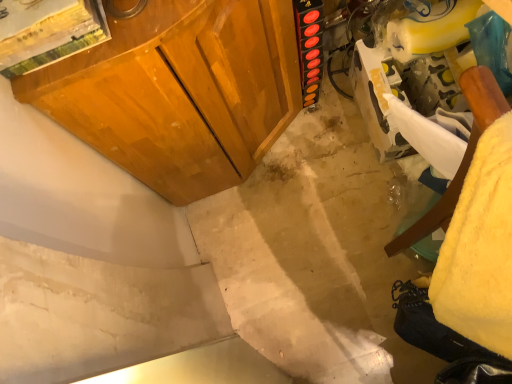
In order to face wooden cabinet at left, should I rotate leftwards or rightwards?

Rotate your view left by about 5.799°.

You are a GUI agent. You are given a task and a screenshot of the screen. Output one action in this format:
    pyautogui.click(x=<x>, y=<y>)
    Task: Click on the wooden cabinet at left
    This screenshot has height=384, width=512.
    Given the screenshot: What is the action you would take?
    pyautogui.click(x=180, y=92)

What do you see at coordinates (180, 92) in the screenshot? The image size is (512, 384). I see `wooden cabinet at left` at bounding box center [180, 92].

Locate an element on the screen. The image size is (512, 384). wooden cabinet at left is located at coordinates (180, 92).